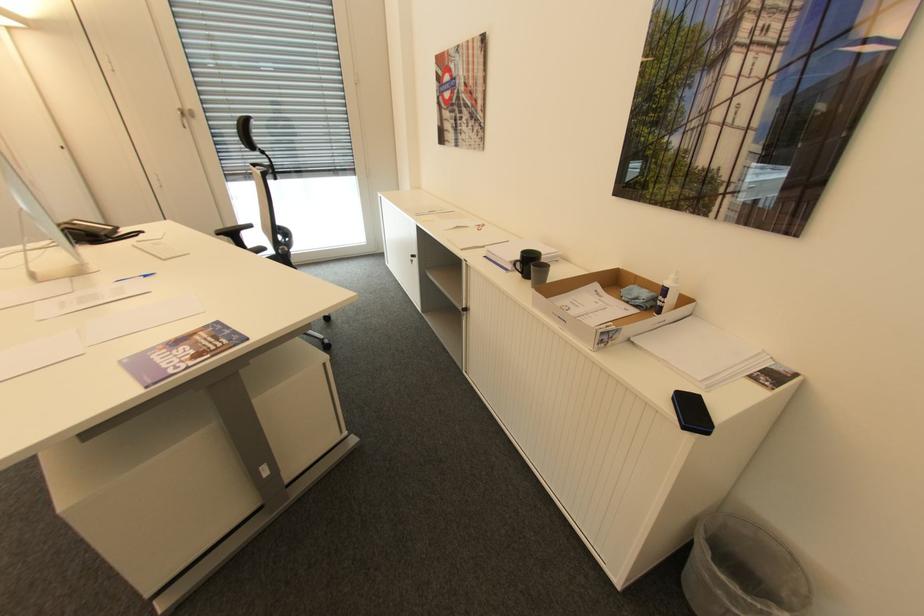
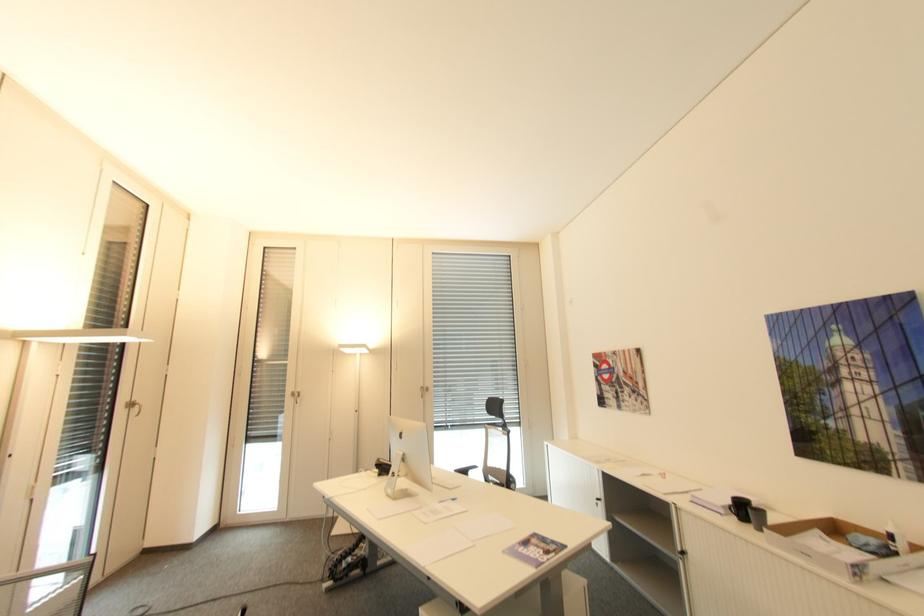
Find the pixel in the second image that matches (670,291) in the first image.

(895, 537)